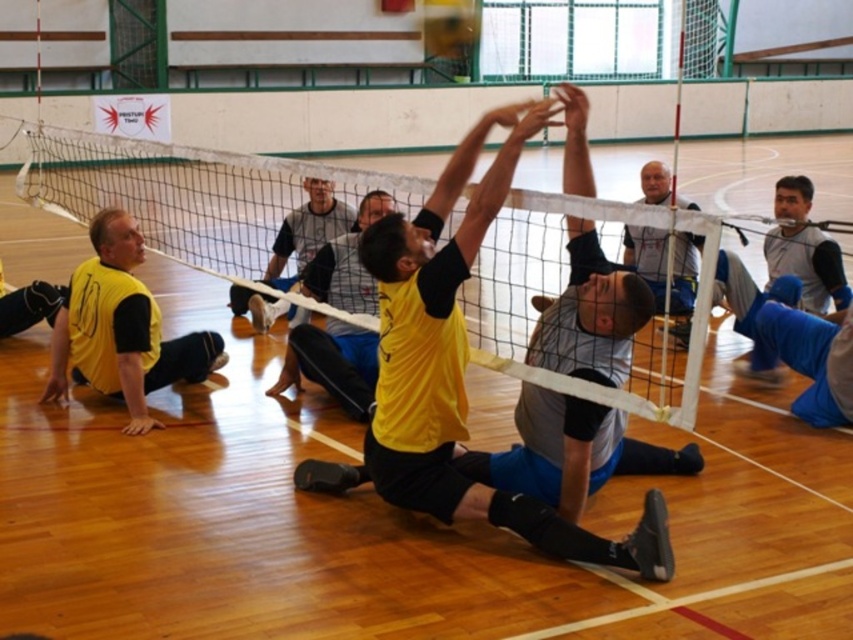
Question: Does yellow matte jersey at left come in front of gray fabric shirt at upper right?

Choices:
 (A) no
 (B) yes

Answer: (B)

Question: Does yellow matte/vinyl squat at center appear over yellow matte jersey at left?

Choices:
 (A) yes
 (B) no

Answer: (B)

Question: Which object appears closest to the camera in this image?

Choices:
 (A) yellow matte/vinyl squat at center
 (B) gray fabric shirt at center

Answer: (A)

Question: Among these objects, which one is farthest from the camera?

Choices:
 (A) yellow matte jersey at left
 (B) white mesh net at upper center

Answer: (B)

Question: Is yellow matte jersey at left behind gray fabric shirt at upper right?

Choices:
 (A) no
 (B) yes

Answer: (A)

Question: Which of the following is the farthest from the observer?

Choices:
 (A) (306, 312)
 (B) (123, 368)
 (C) (682, 198)
 (D) (392, 422)

Answer: (C)